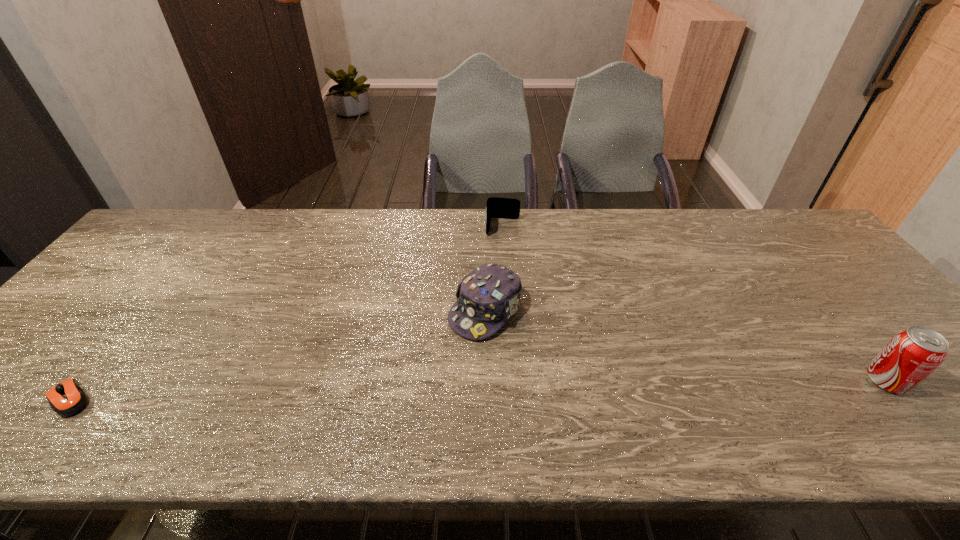
Find the location of `vacant area between the third nearest object and the shortest object`. vacant area between the third nearest object and the shortest object is located at coordinates (277, 354).

This screenshot has width=960, height=540. What are the coordinates of `free spot between the computer mouse and the wallet` in the screenshot? It's located at (286, 313).

The image size is (960, 540). I want to click on vacant area that lies between the third tallest object and the computer mouse, so click(x=286, y=313).

At what (x,y) coordinates should I click in order to perform the action: click on vacant space in between the rightmost object and the second farthest object. Please return your answer as a coordinate pair (x, y). This screenshot has height=540, width=960. Looking at the image, I should click on (685, 345).

Find the location of a particular element. The image size is (960, 540). blank region between the tallest object and the farthest object is located at coordinates (694, 304).

In order to click on vacant space that's between the leftmost object and the rightmost object in this screenshot , I will do `click(478, 389)`.

The width and height of the screenshot is (960, 540). I want to click on empty space between the headwear and the shortest object, so click(x=277, y=354).

Select which object is the third closest to the computer mouse. Please provide its 2D coordinates. Your answer should be formatted as a tuple, i.e. [(x, y)], where the tuple contains the x and y coordinates of a point satisfying the conditions above.

[(913, 354)]

Where is `object identified as the second closest to the soda`? object identified as the second closest to the soda is located at coordinates coord(506,208).

I want to click on free location that satisfies the following two spatial constraints: 1. on the back side of the shortest object; 2. on the left side of the wallet, so click(x=205, y=227).